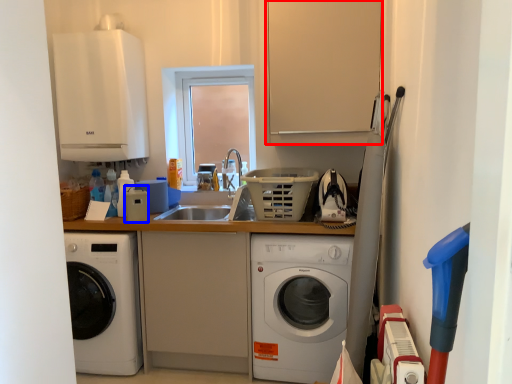
Question: Among these objects, which one is farthest to the camera, cabinetry (highlighted by a red box) or appliance (highlighted by a blue box)?

Choices:
 (A) cabinetry
 (B) appliance

Answer: (B)